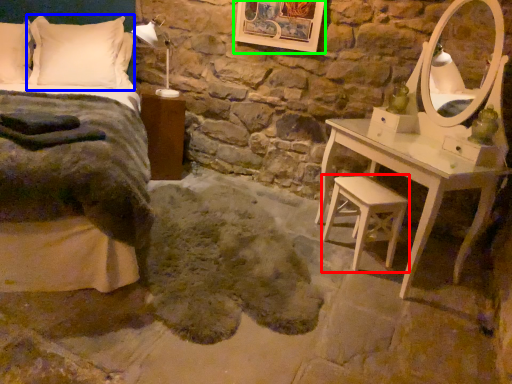
Question: Which is farther away from swivel chair (highlighted by a red box)? pillow (highlighted by a blue box) or picture frame (highlighted by a green box)?

Choices:
 (A) pillow
 (B) picture frame

Answer: (A)